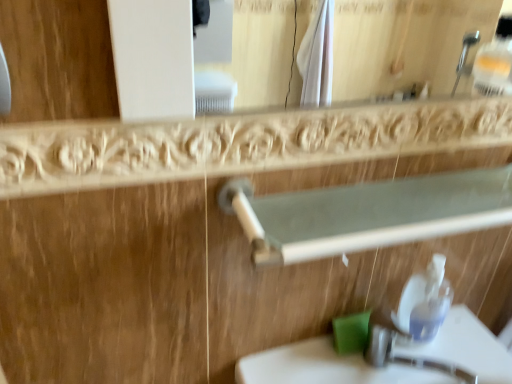
Looking at this image, measure the distance between point (434, 198) and camera.

26.50 inches.

Locate an element on the screen. This screenshot has width=512, height=384. transparent plastic soap dispenser at lower right is located at coordinates (432, 303).

Locate an element on the screen. The height and width of the screenshot is (384, 512). white plastic rail at upper center is located at coordinates (367, 213).

Considering the relative sizes of green matte soap at lower center and white glossy sink at lower center in the image provided, is green matte soap at lower center wider than white glossy sink at lower center?

No.

From a real-world perspective, between green matte soap at lower center and white glossy sink at lower center, who is vertically higher?

green matte soap at lower center is physically above.

Is green matte soap at lower center smaller than white glossy sink at lower center?

Correct, green matte soap at lower center occupies less space than white glossy sink at lower center.

Is the surface of green matte soap at lower center in direct contact with white glossy sink at lower center?

No, green matte soap at lower center is not in contact with white glossy sink at lower center.

Can you confirm if white glossy sink at lower center is shorter than green matte soap at lower center?

In fact, white glossy sink at lower center may be taller than green matte soap at lower center.

From the image's perspective, would you say white glossy sink at lower center is shown under green matte soap at lower center?

Yes, from the image's perspective, white glossy sink at lower center is below green matte soap at lower center.

Does white glossy sink at lower center appear on the right side of green matte soap at lower center?

Indeed, white glossy sink at lower center is positioned on the right side of green matte soap at lower center.

Relative to transparent plastic soap dispenser at lower right, is white plastic rail at upper center in front or behind?

white plastic rail at upper center is positioned closer to the viewer than transparent plastic soap dispenser at lower right.

Can transparent plastic soap dispenser at lower right be found inside white plastic rail at upper center?

No.

Is white plastic rail at upper center placed right next to transparent plastic soap dispenser at lower right?

No.

Considering the relative sizes of transparent plastic soap dispenser at lower right and white plastic rail at upper center in the image provided, is transparent plastic soap dispenser at lower right wider than white plastic rail at upper center?

No, transparent plastic soap dispenser at lower right is not wider than white plastic rail at upper center.

Which object is positioned more to the left, transparent plastic soap dispenser at lower right or white plastic rail at upper center?

From the viewer's perspective, white plastic rail at upper center appears more on the left side.

At what (x,y) coordinates should I click in order to perform the action: click on soap dispenser behind the white plastic rail at upper center. Please return your answer as a coordinate pair (x, y). Looking at the image, I should click on (432, 303).

From the image's perspective, which object appears higher, transparent plastic soap dispenser at lower right or white plastic rail at upper center?

white plastic rail at upper center is shown above in the image.

Is transparent plastic soap dispenser at lower right far away from white glossy sink at lower center?

No, transparent plastic soap dispenser at lower right is not far from white glossy sink at lower center.

Who is more distant, transparent plastic soap dispenser at lower right or white glossy sink at lower center?

Positioned behind is transparent plastic soap dispenser at lower right.

Which is behind, point (441, 311) or point (504, 357)?

Point (504, 357)

Between transparent plastic soap dispenser at lower right and white glossy sink at lower center, which one has more height?

transparent plastic soap dispenser at lower right is taller.

Considering the points (318, 346) and (423, 213), which point is behind, point (318, 346) or point (423, 213)?

Point (318, 346)

Which of these two, white glossy sink at lower center or white plastic rail at upper center, is bigger?

white glossy sink at lower center.

Does white glossy sink at lower center come behind white plastic rail at upper center?

Yes, it is behind white plastic rail at upper center.

Does white glossy sink at lower center touch white plastic rail at upper center?

No, white glossy sink at lower center is not beside white plastic rail at upper center.

From the image's perspective, which is above, white glossy sink at lower center or transparent plastic soap dispenser at lower right?

transparent plastic soap dispenser at lower right appears higher in the image.

Is white glossy sink at lower center behind transparent plastic soap dispenser at lower right?

No.

Is point (261, 381) positioned after point (435, 308)?

That is False.

Identify the location of soap above the white glossy sink at lower center (from a real-world perspective). (351, 332).

Image resolution: width=512 pixels, height=384 pixels. I want to click on sink in front of the green matte soap at lower center, so tap(328, 367).

From the image, which object appears to be farther from white plastic rail at upper center, green matte soap at lower center or transparent plastic soap dispenser at lower right?

Among the two, green matte soap at lower center is located further to white plastic rail at upper center.

Considering their positions, is transparent plastic soap dispenser at lower right positioned closer to white glossy sink at lower center than green matte soap at lower center?

Among the two, transparent plastic soap dispenser at lower right is located nearer to white glossy sink at lower center.

When comparing their distances from transparent plastic soap dispenser at lower right, does green matte soap at lower center or white plastic rail at upper center seem closer?

The object closer to transparent plastic soap dispenser at lower right is green matte soap at lower center.

Looking at the image, which one is located further to white glossy sink at lower center, white plastic rail at upper center or green matte soap at lower center?

→ Based on the image, white plastic rail at upper center appears to be further to white glossy sink at lower center.

Which object lies nearer to the anchor point white plastic rail at upper center, transparent plastic soap dispenser at lower right or green matte soap at lower center?

transparent plastic soap dispenser at lower right lies closer to white plastic rail at upper center than the other object.

Estimate the real-world distances between objects in this image. Which object is further from green matte soap at lower center, white glossy sink at lower center or white plastic rail at upper center?

The object further to green matte soap at lower center is white plastic rail at upper center.

Based on the photo, based on their spatial positions, is white plastic rail at upper center or transparent plastic soap dispenser at lower right closer to green matte soap at lower center?

transparent plastic soap dispenser at lower right lies closer to green matte soap at lower center than the other object.

Looking at the image, which one is located further to transparent plastic soap dispenser at lower right, white glossy sink at lower center or green matte soap at lower center?

green matte soap at lower center is further to transparent plastic soap dispenser at lower right.

Where is `soap that lies between transparent plastic soap dispenser at lower right and white glossy sink at lower center from top to bottom`? Image resolution: width=512 pixels, height=384 pixels. soap that lies between transparent plastic soap dispenser at lower right and white glossy sink at lower center from top to bottom is located at coordinates (351, 332).

The image size is (512, 384). I want to click on soap dispenser between white plastic rail at upper center and green matte soap at lower center from front to back, so click(432, 303).

Identify the location of soap between white plastic rail at upper center and white glossy sink at lower center from top to bottom. The image size is (512, 384). (351, 332).

The width and height of the screenshot is (512, 384). In order to click on soap dispenser between white plastic rail at upper center and white glossy sink at lower center from top to bottom in this screenshot , I will do `click(432, 303)`.